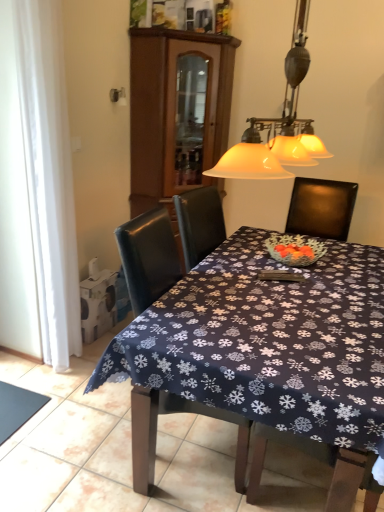
Question: From the image's perspective, is brown wood cabinet at upper center under dark blue fabric at lower left?

Choices:
 (A) yes
 (B) no

Answer: (B)

Question: From a real-world perspective, is brown wood cabinet at upper center positioned over dark blue fabric at lower left based on gravity?

Choices:
 (A) yes
 (B) no

Answer: (A)

Question: Considering the relative sizes of brown wood cabinet at upper center and dark blue fabric at lower left in the image provided, is brown wood cabinet at upper center smaller than dark blue fabric at lower left?

Choices:
 (A) yes
 (B) no

Answer: (B)

Question: Is brown wood cabinet at upper center not within dark blue fabric at lower left?

Choices:
 (A) no
 (B) yes

Answer: (B)

Question: Is brown wood cabinet at upper center with dark blue fabric at lower left?

Choices:
 (A) no
 (B) yes

Answer: (A)

Question: Based on their sizes in the image, would you say white glass lampshade at upper center is bigger or smaller than dark blue fabric at lower left?

Choices:
 (A) big
 (B) small

Answer: (A)

Question: From the image's perspective, is white glass lampshade at upper center above or below dark blue fabric at lower left?

Choices:
 (A) above
 (B) below

Answer: (A)

Question: Considering the positions of white glass lampshade at upper center and dark blue fabric at lower left in the image, is white glass lampshade at upper center wider or thinner than dark blue fabric at lower left?

Choices:
 (A) thin
 (B) wide

Answer: (A)

Question: Considering the relative positions of white glass lampshade at upper center and dark blue fabric at lower left in the image provided, is white glass lampshade at upper center to the left or to the right of dark blue fabric at lower left?

Choices:
 (A) right
 (B) left

Answer: (A)

Question: Considering the relative positions of brown wood cabinet at upper center and leather chair at center in the image provided, is brown wood cabinet at upper center to the left or to the right of leather chair at center?

Choices:
 (A) left
 (B) right

Answer: (A)

Question: Is brown wood cabinet at upper center wider or thinner than leather chair at center?

Choices:
 (A) thin
 (B) wide

Answer: (A)

Question: From a real-world perspective, relative to leather chair at center, is brown wood cabinet at upper center vertically above or below?

Choices:
 (A) below
 (B) above

Answer: (B)

Question: Is point (157, 141) positioned closer to the camera than point (244, 457)?

Choices:
 (A) closer
 (B) farther

Answer: (B)

Question: From a real-world perspective, relative to leather chair at center, is dark blue fabric at lower left vertically above or below?

Choices:
 (A) below
 (B) above

Answer: (A)

Question: From their relative heights in the image, would you say dark blue fabric at lower left is taller or shorter than leather chair at center?

Choices:
 (A) short
 (B) tall

Answer: (A)